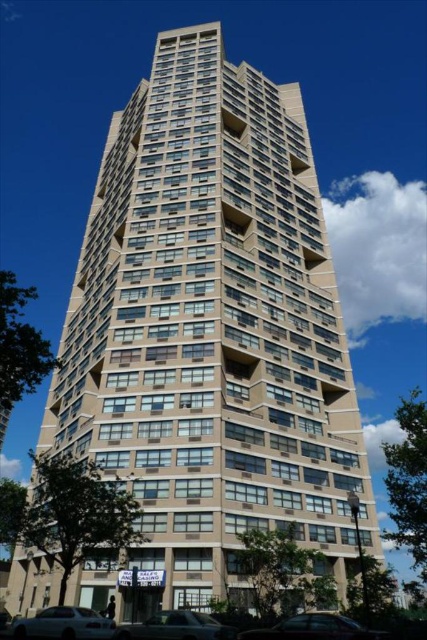
You are a delivery person trying to park your van next to the silver metallic sedan at lower center and the metallic silver car at lower center. Since your van is 2 meters tall, can you safely park there without hitting the roof?

The silver metallic sedan at lower center is not as tall as metallic silver car at lower center, but the height of the metallic silver car at lower center is not provided. Therefore, it is uncertain if the van can park safely without hitting the roof.

You are a delivery person standing at the entrance of the residential building. You need to park your 5.5 meter long delivery van between the silver metallic sedan at lower left and the metallic silver car at lower center. Is there enough space for your van between them?

The distance between the silver metallic sedan at lower left and the metallic silver car at lower center is 10.04 meters. Since the van is 5.5 meters long, there is sufficient space to park it between them as 10.04 meters is greater than 5.5 meters.